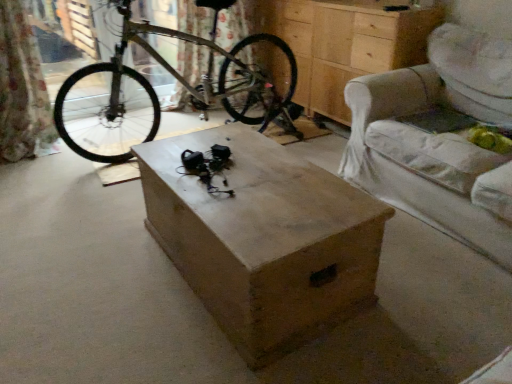
Question: From the image's perspective, is silver metallic bicycle at center above or below light beige fabric armchair at right?

Choices:
 (A) below
 (B) above

Answer: (B)

Question: From a real-world perspective, is silver metallic bicycle at center above or below light beige fabric armchair at right?

Choices:
 (A) below
 (B) above

Answer: (B)

Question: Which is nearer to the silver metallic bicycle at center?

Choices:
 (A) light beige fabric armchair at right
 (B) wooden chest of drawers at center
 (C) wooden box at center

Answer: (B)

Question: Estimate the real-world distances between objects in this image. Which object is closer to the silver metallic bicycle at center?

Choices:
 (A) light beige fabric armchair at right
 (B) wooden box at center
 (C) wooden chest of drawers at center

Answer: (C)